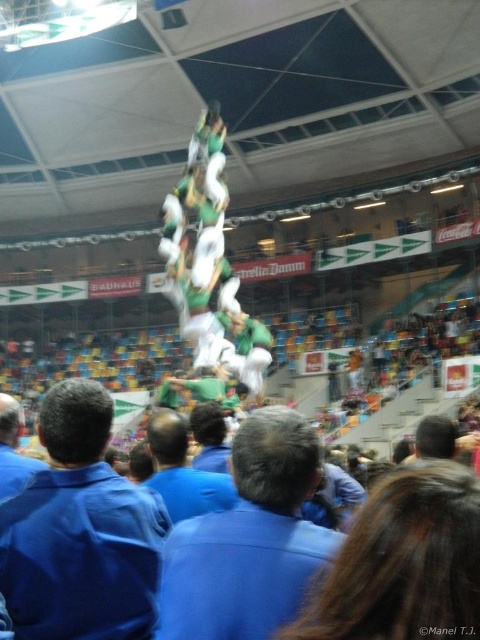
Which is in front, point (34, 465) or point (173, 384)?

Point (34, 465) is more forward.

This screenshot has height=640, width=480. What are the coordinates of `blue shirt at lower left` in the screenshot? It's located at (12, 449).

Where is `blue shirt at lower left`? Image resolution: width=480 pixels, height=640 pixels. blue shirt at lower left is located at coordinates (12, 449).

Does blue shirt at center have a greater height compared to green fabric man at center?

Correct, blue shirt at center is much taller as green fabric man at center.

Is blue shirt at center shorter than green fabric man at center?

In fact, blue shirt at center may be taller than green fabric man at center.

Between point (179, 486) and point (186, 381), which one is positioned behind?

Point (186, 381)

This screenshot has width=480, height=640. Identify the location of blue shirt at center. (182, 470).

How distant is blue fabric shirt at center from brown hair at center?

The distance of blue fabric shirt at center from brown hair at center is 13.18 feet.

Does blue fabric shirt at center lie in front of brown hair at center?

No, it is not.

Image resolution: width=480 pixels, height=640 pixels. I want to click on blue fabric shirt at center, so click(250, 540).

The image size is (480, 640). In order to click on blue fabric shirt at center in this screenshot , I will do `click(250, 540)`.